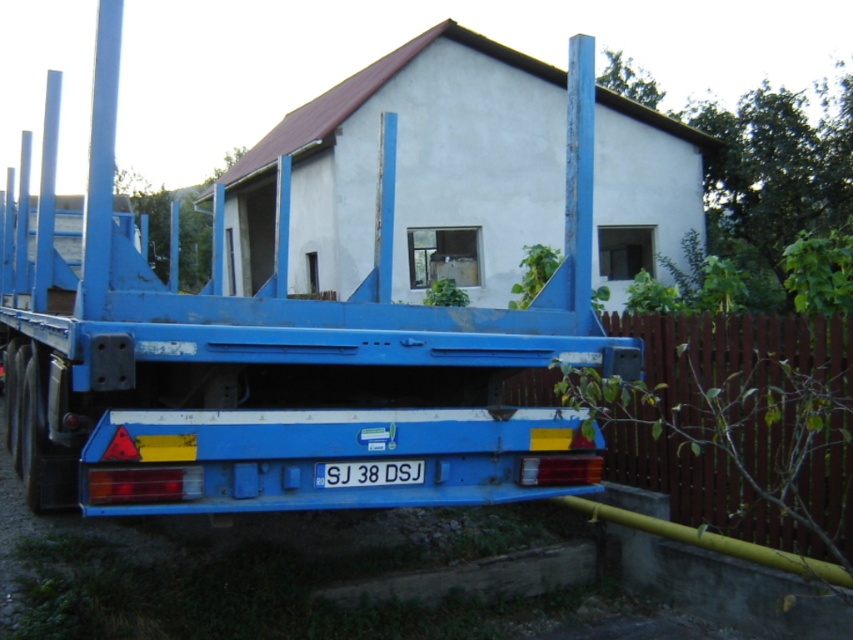
Locate an element on the screen. This screenshot has width=853, height=640. blue metallic trailer truck at center is located at coordinates pyautogui.click(x=283, y=356).

Looking at this image, is blue metallic trailer truck at center thinner than white plastic license plate at center?

In fact, blue metallic trailer truck at center might be wider than white plastic license plate at center.

Describe the element at coordinates (283, 356) in the screenshot. I see `blue metallic trailer truck at center` at that location.

You are a GUI agent. You are given a task and a screenshot of the screen. Output one action in this format:
    pyautogui.click(x=<x>, y=<y>)
    Task: Click on the blue metallic trailer truck at center
    
    Given the screenshot: What is the action you would take?
    pyautogui.click(x=283, y=356)

Which is more to the left, brown wooden fence at right or white plastic license plate at center?

From the viewer's perspective, white plastic license plate at center appears more on the left side.

Is point (730, 476) closer to camera compared to point (334, 467)?

No, it is not.

The width and height of the screenshot is (853, 640). I want to click on brown wooden fence at right, so click(x=743, y=426).

Is blue metallic trailer truck at center positioned in front of brown wooden fence at right?

Yes, it is in front of brown wooden fence at right.

Which is more to the left, blue metallic trailer truck at center or brown wooden fence at right?

Positioned to the left is blue metallic trailer truck at center.

Is point (51, 406) positioned behind point (674, 362)?

That is False.

Identify the location of blue metallic trailer truck at center. Image resolution: width=853 pixels, height=640 pixels. (283, 356).